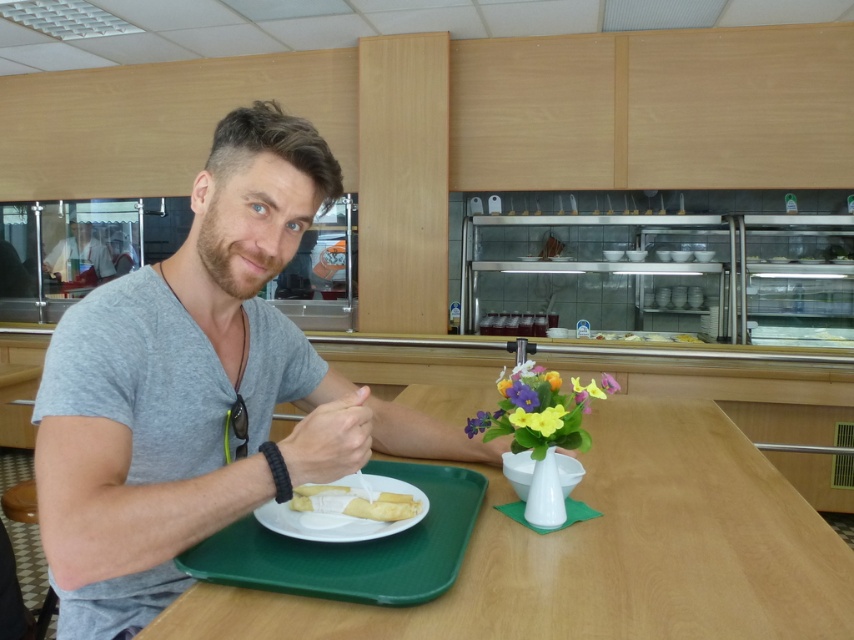
Question: From the image, what is the correct spatial relationship of wooden table at center in relation to white glossy plate at center?

Choices:
 (A) left
 (B) right

Answer: (B)

Question: Estimate the real-world distances between objects in this image. Which object is farther from the wooden table at center?

Choices:
 (A) gray matte shirt at center
 (B) white matte crepe at center

Answer: (B)

Question: Is gray matte shirt at center wider than wooden table at center?

Choices:
 (A) no
 (B) yes

Answer: (A)

Question: Is wooden table at center above pink matte flower at center?

Choices:
 (A) no
 (B) yes

Answer: (A)

Question: Among these points, which one is nearest to the camera?

Choices:
 (A) (291, 504)
 (B) (814, 618)

Answer: (B)

Question: Which of the following is the farthest from the observer?

Choices:
 (A) white matte crepe at center
 (B) gray matte shirt at center
 (C) white glossy plate at center
 (D) pink matte flower at center

Answer: (D)